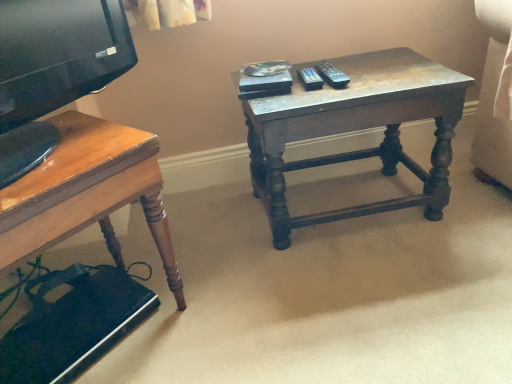
At what (x,y) coordinates should I click in order to perform the action: click on spots to the right of wooden desk at lower left. Please return your answer as a coordinate pair (x, y). This screenshot has height=384, width=512. Looking at the image, I should click on (231, 301).